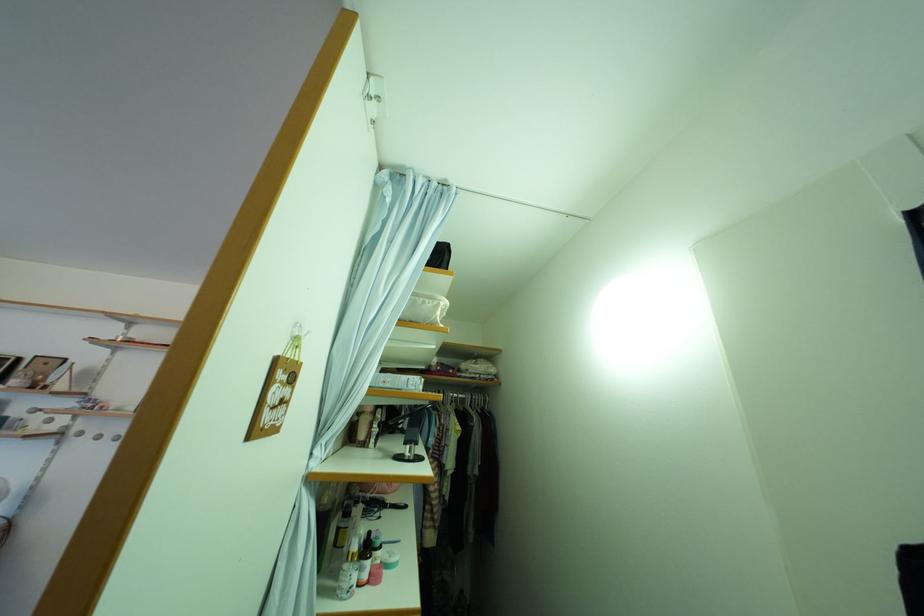
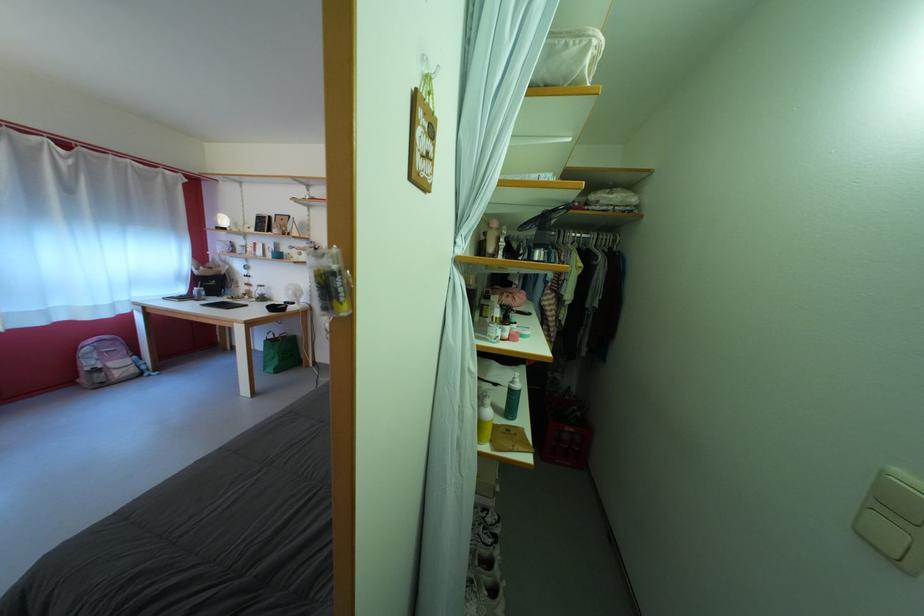
First-person continuous shooting, in which direction is the camera rotating?

The camera's rotation is toward left-down.